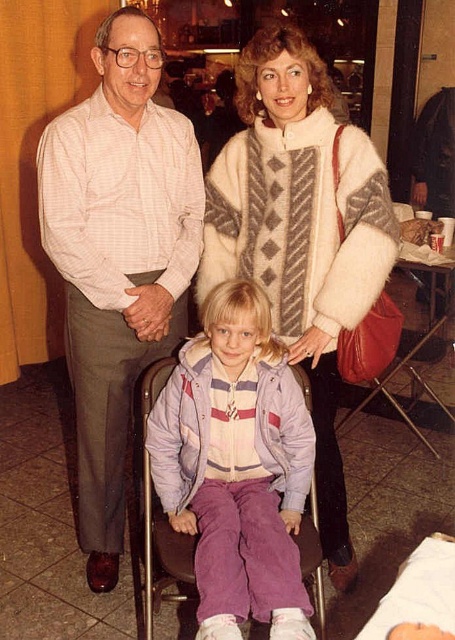
You are a photographer setting up for a group photo. You need to ensure that the fuzzy white coat at upper center and the purple corduroy pants at center are both visible in the frame. Based on their heights, which object should be placed closer to the camera to maintain visibility?

The fuzzy white coat at upper center is taller than the purple corduroy pants at center, so to maintain visibility for both, the purple corduroy pants at center should be placed closer to the camera.

You are a photographer standing 20 inches away from the light pink checkered shirt at center and the fuzzy white coat at upper center. Can you reach both items with a 12 inch long extension pole?

The light pink checkered shirt at center is 16.72 inches away from the fuzzy white coat at upper center. Since the photographer is 20 inches away from both items, the total distance between the photographer and each item would be 20 inches plus the distance between them. However, the extension pole is only 12 inches long, which is insufficient to reach either item from that distance.